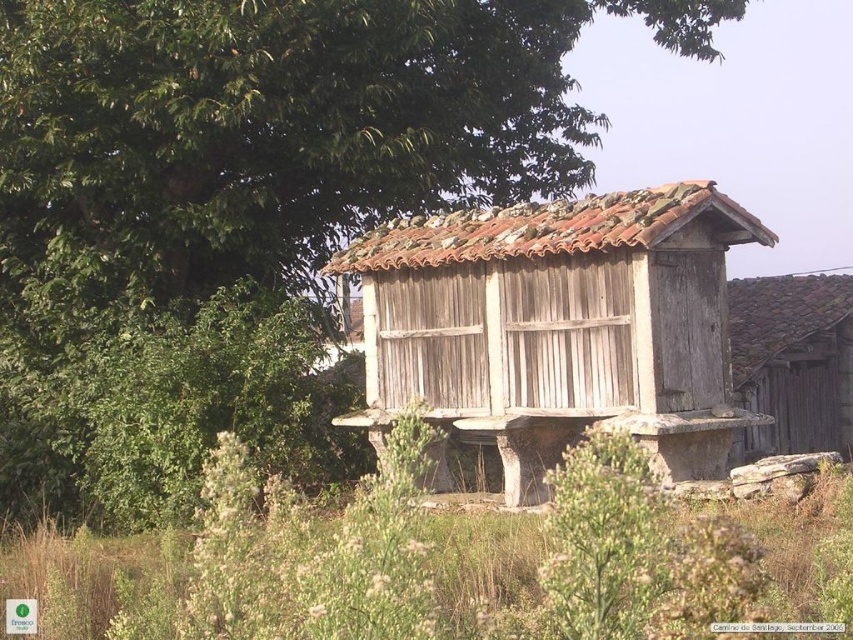
Question: Is green leafy tree at upper left thinner than weathered wood hut at center?

Choices:
 (A) no
 (B) yes

Answer: (A)

Question: Among these objects, which one is nearest to the camera?

Choices:
 (A) weathered wood hut at center
 (B) green leafy tree at upper left

Answer: (A)

Question: Is green leafy tree at upper left smaller than wooden barn at right?

Choices:
 (A) yes
 (B) no

Answer: (A)

Question: Which point appears closest to the camera in this image?

Choices:
 (A) (848, 401)
 (B) (132, 168)

Answer: (B)

Question: Among these objects, which one is nearest to the camera?

Choices:
 (A) green leafy tree at upper left
 (B) wooden barn at right
 (C) weathered wood hut at center

Answer: (C)

Question: Does green leafy tree at upper left appear under weathered wood hut at center?

Choices:
 (A) yes
 (B) no

Answer: (B)